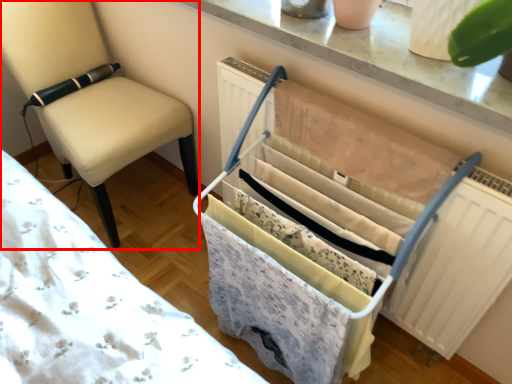
Question: In this image, where is chair (annotated by the red box) located relative to baby carriage?

Choices:
 (A) right
 (B) left

Answer: (B)